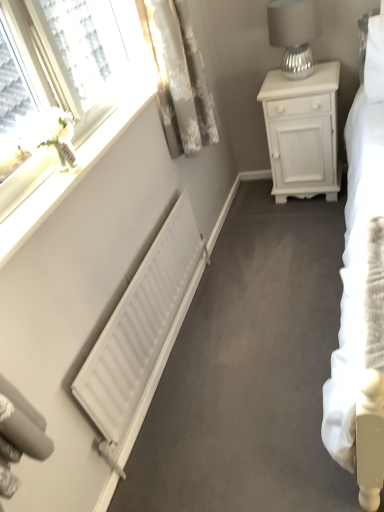
Where is `free space in front of white matte radiator at lower left`? The height and width of the screenshot is (512, 384). free space in front of white matte radiator at lower left is located at coordinates (214, 419).